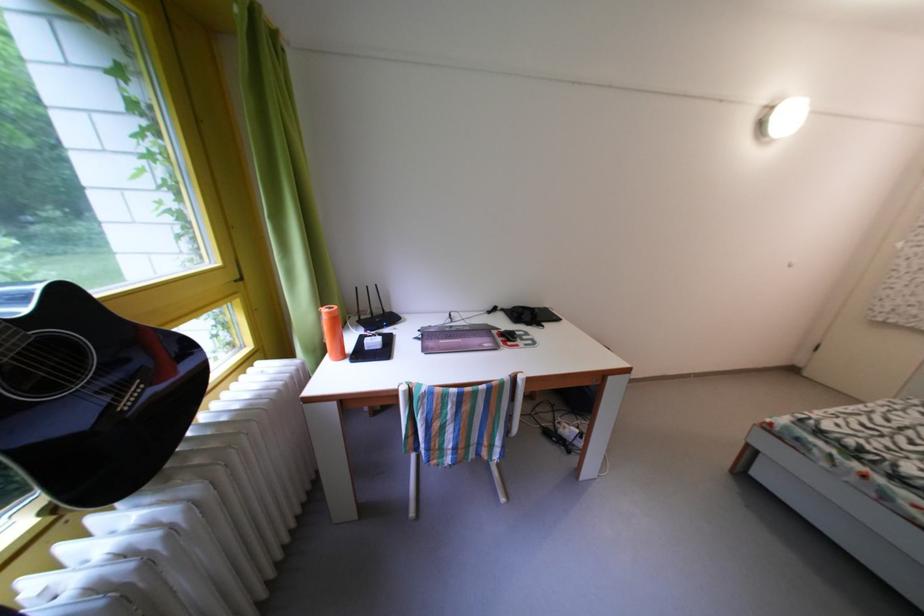
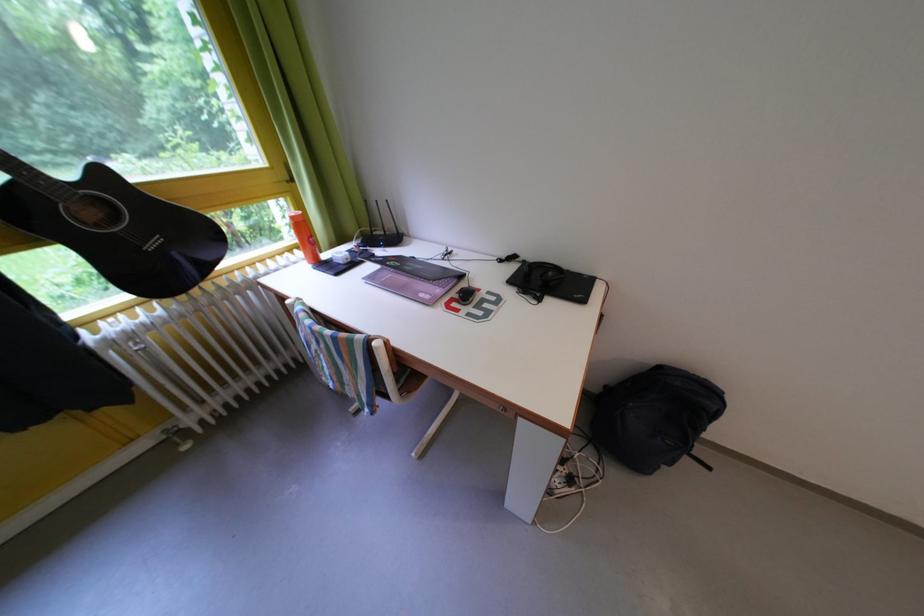
Where in the second image is the point corresponding to (x=379, y=322) from the first image?

(392, 238)